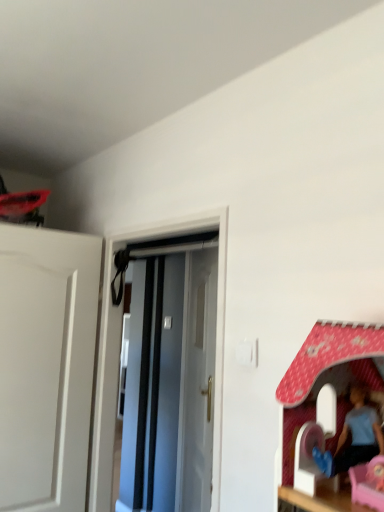
Question: Does white glossy door at center, the 2th door when ordered from front to back, contain white glossy door at center, which is the 1th door in front-to-back order?

Choices:
 (A) no
 (B) yes

Answer: (A)

Question: From the image's perspective, is white glossy door at center, the 2th door when ordered from front to back, below white glossy door at center, marked as the second door in a back-to-front arrangement?

Choices:
 (A) yes
 (B) no

Answer: (A)

Question: Does white glossy door at center, placed as the 1th door when sorted from back to front, have a smaller size compared to white glossy door at center, which is the 1th door in front-to-back order?

Choices:
 (A) no
 (B) yes

Answer: (A)

Question: Considering the relative positions of white glossy door at center, the 2th door when ordered from front to back, and white glossy door at center, which is the 1th door in front-to-back order, in the image provided, is white glossy door at center, the 2th door when ordered from front to back, behind white glossy door at center, which is the 1th door in front-to-back order,?

Choices:
 (A) no
 (B) yes

Answer: (B)

Question: Is white glossy door at center, the 2th door when ordered from front to back, wider than white glossy door at center, marked as the second door in a back-to-front arrangement?

Choices:
 (A) no
 (B) yes

Answer: (A)

Question: Does white glossy door at center, the 2th door when ordered from front to back, have a lesser width compared to white glossy door at center, which is the 1th door in front-to-back order?

Choices:
 (A) yes
 (B) no

Answer: (A)

Question: Is white glossy door at center, which is the 1th door in front-to-back order, touching white glossy door at center, placed as the 1th door when sorted from back to front?

Choices:
 (A) no
 (B) yes

Answer: (A)

Question: Considering the relative positions of white glossy door at center, marked as the second door in a back-to-front arrangement, and white glossy door at center, placed as the 1th door when sorted from back to front, in the image provided, is white glossy door at center, marked as the second door in a back-to-front arrangement, to the right of white glossy door at center, placed as the 1th door when sorted from back to front, from the viewer's perspective?

Choices:
 (A) yes
 (B) no

Answer: (B)

Question: Is there a large distance between white glossy door at center, marked as the second door in a back-to-front arrangement, and white glossy door at center, placed as the 1th door when sorted from back to front?

Choices:
 (A) yes
 (B) no

Answer: (B)

Question: Can you confirm if white glossy door at center, marked as the second door in a back-to-front arrangement, is bigger than white glossy door at center, placed as the 1th door when sorted from back to front?

Choices:
 (A) yes
 (B) no

Answer: (B)

Question: Is white glossy door at center, marked as the second door in a back-to-front arrangement, smaller than white glossy door at center, placed as the 1th door when sorted from back to front?

Choices:
 (A) yes
 (B) no

Answer: (A)

Question: Does white glossy door at center, marked as the second door in a back-to-front arrangement, have a greater width compared to white glossy door at center, the 2th door when ordered from front to back?

Choices:
 (A) yes
 (B) no

Answer: (A)

Question: Visually, is white glossy door at center, marked as the second door in a back-to-front arrangement, positioned to the left or to the right of white glossy door at center, the 2th door when ordered from front to back?

Choices:
 (A) right
 (B) left

Answer: (B)